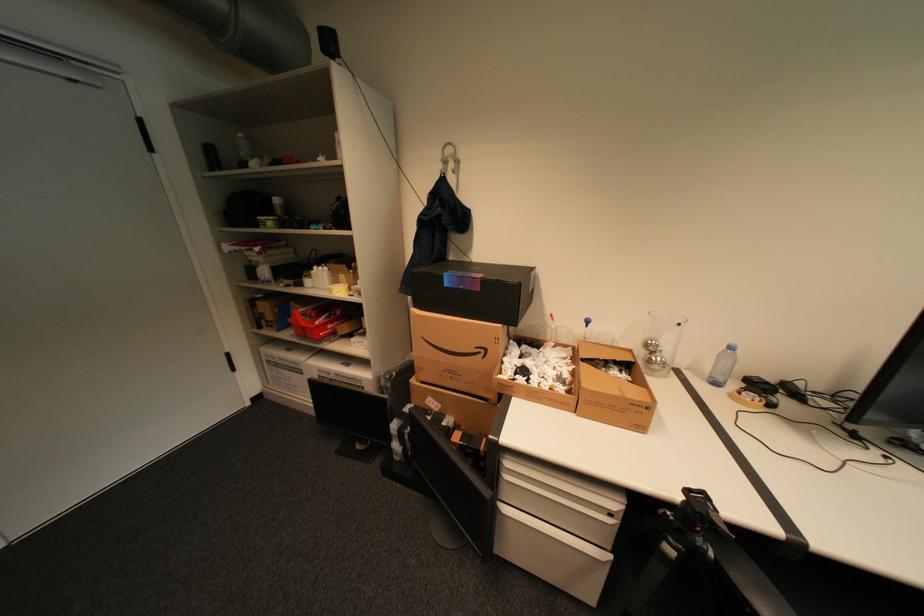
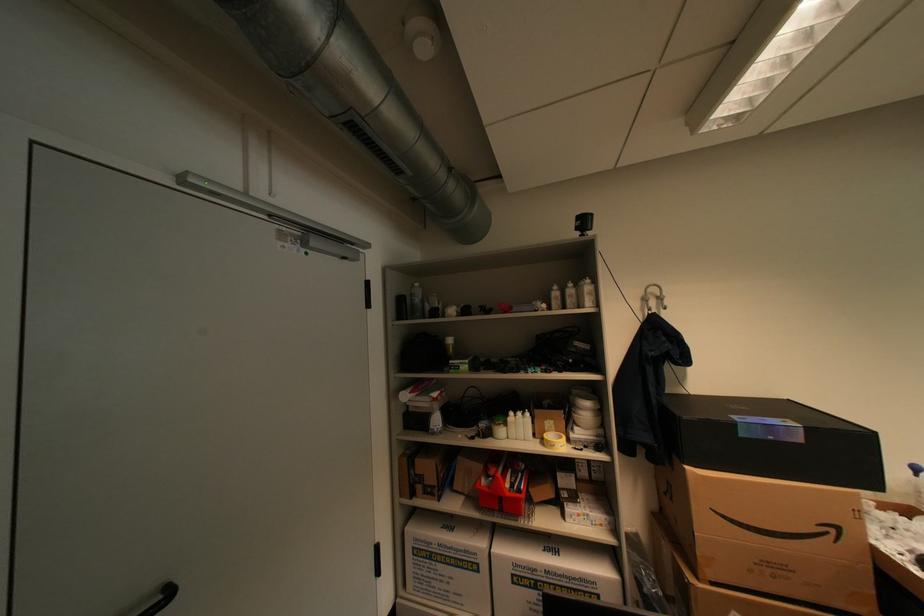
Where in the second image is the point corresponding to pixel 285 365 from the first image?

(439, 556)